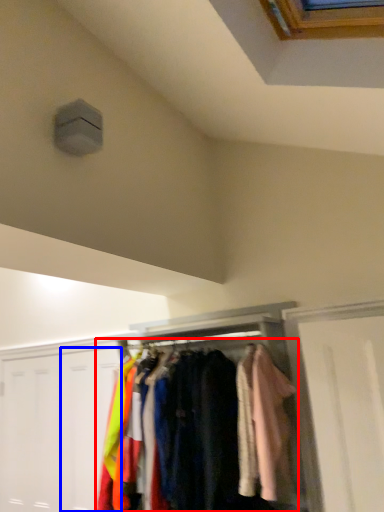
Question: Which of the following is the farthest to the observer, garment (highlighted by a red box) or door (highlighted by a blue box)?

Choices:
 (A) garment
 (B) door

Answer: (B)